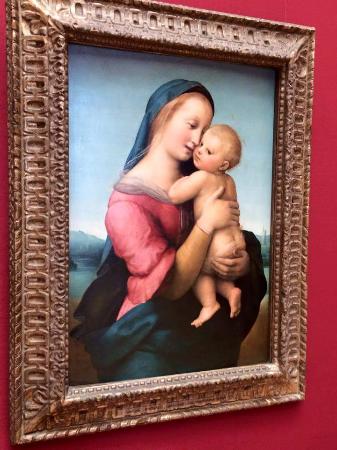
Image resolution: width=337 pixels, height=450 pixels. I want to click on left side frame, so click(38, 171).